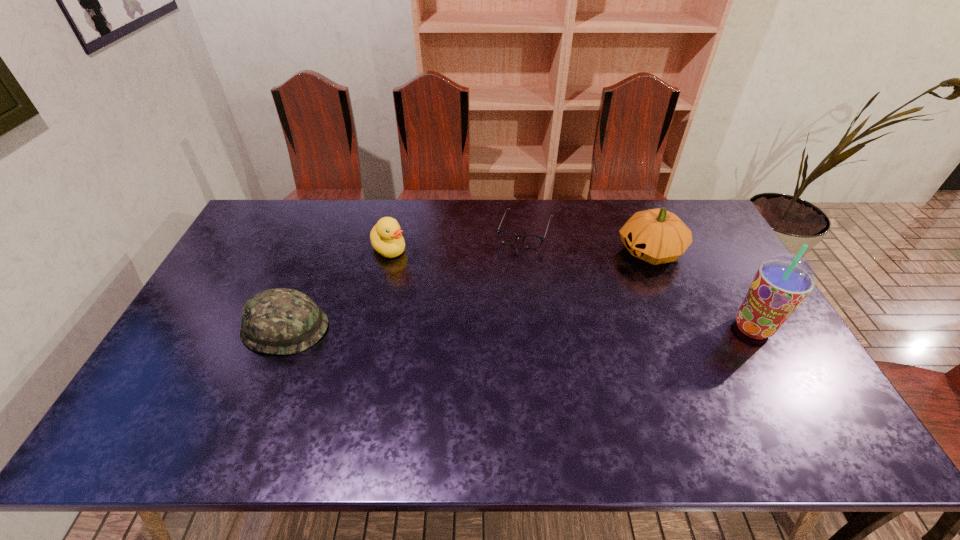
Image resolution: width=960 pixels, height=540 pixels. Find the location of `vacant region between the duck and the rightmost object`. vacant region between the duck and the rightmost object is located at coordinates (571, 288).

Identify which object is the second closest to the gourd. Please provide its 2D coordinates. Your answer should be formatted as a tuple, i.e. [(x, y)], where the tuple contains the x and y coordinates of a point satisfying the conditions above.

[(508, 237)]

Find the location of a particular element. Image resolution: width=960 pixels, height=540 pixels. object that is the third closest to the shortest object is located at coordinates (782, 282).

You are a GUI agent. You are given a task and a screenshot of the screen. Output one action in this format:
    pyautogui.click(x=<x>, y=<y>)
    Task: Click on the vacant region that satisfies the following two spatial constraints: 1. on the front side of the shortest object; 2. on the left side of the tallest object
    The width and height of the screenshot is (960, 540).
    Given the screenshot: What is the action you would take?
    pyautogui.click(x=537, y=328)

Where is `vacant region that satisfies the following two spatial constraints: 1. on the front side of the gourd; 2. on the right side of the third object from left to right`? Image resolution: width=960 pixels, height=540 pixels. vacant region that satisfies the following two spatial constraints: 1. on the front side of the gourd; 2. on the right side of the third object from left to right is located at coordinates (527, 252).

Where is `free location that satisfies the following two spatial constraints: 1. on the back side of the second object from left to right; 2. on the left side of the headwear`? Image resolution: width=960 pixels, height=540 pixels. free location that satisfies the following two spatial constraints: 1. on the back side of the second object from left to right; 2. on the left side of the headwear is located at coordinates (318, 248).